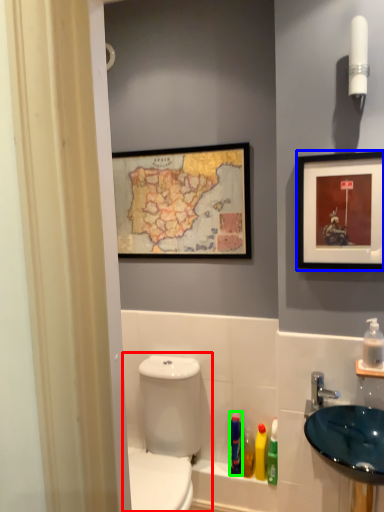
Question: Which object is the farthest from toilet (highlighted by a red box)? Choose among these: picture frame (highlighted by a blue box) or mouthwash (highlighted by a green box).

Choices:
 (A) picture frame
 (B) mouthwash

Answer: (A)